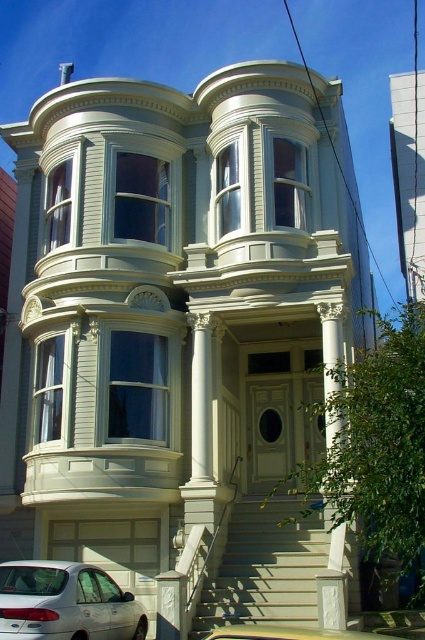
Question: Does silver metallic sedan at lower left appear on the left side of yellow matte taxi at lower center?

Choices:
 (A) yes
 (B) no

Answer: (A)

Question: Does silver metallic sedan at lower left come behind white carved column at right?

Choices:
 (A) yes
 (B) no

Answer: (B)

Question: Considering the relative positions of smooth beige stairs at center and yellow matte taxi at lower center in the image provided, where is smooth beige stairs at center located with respect to yellow matte taxi at lower center?

Choices:
 (A) left
 (B) right

Answer: (B)

Question: Which point is closer to the camera?

Choices:
 (A) silver metallic sedan at lower left
 (B) smooth beige stairs at center
 (C) yellow matte taxi at lower center

Answer: (C)

Question: Estimate the real-world distances between objects in this image. Which object is farther from the silver metallic sedan at lower left?

Choices:
 (A) white carved column at right
 (B) yellow matte taxi at lower center

Answer: (A)

Question: Which object is closer to the camera taking this photo?

Choices:
 (A) white carved column at right
 (B) yellow matte taxi at lower center
 (C) smooth beige stairs at center
 (D) silver metallic sedan at lower left

Answer: (B)